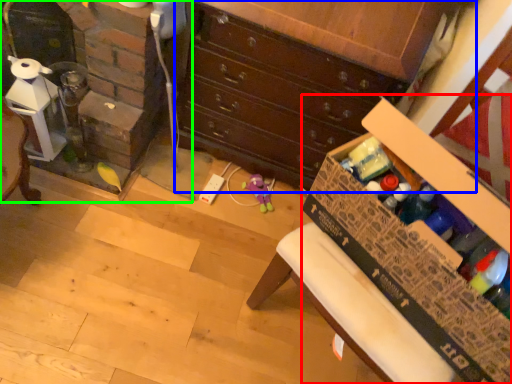
Question: Considering the real-world distances, which object is farthest from cardboard box (highlighted by a red box)? chest of drawers (highlighted by a blue box) or fireplace (highlighted by a green box)?

Choices:
 (A) chest of drawers
 (B) fireplace

Answer: (B)